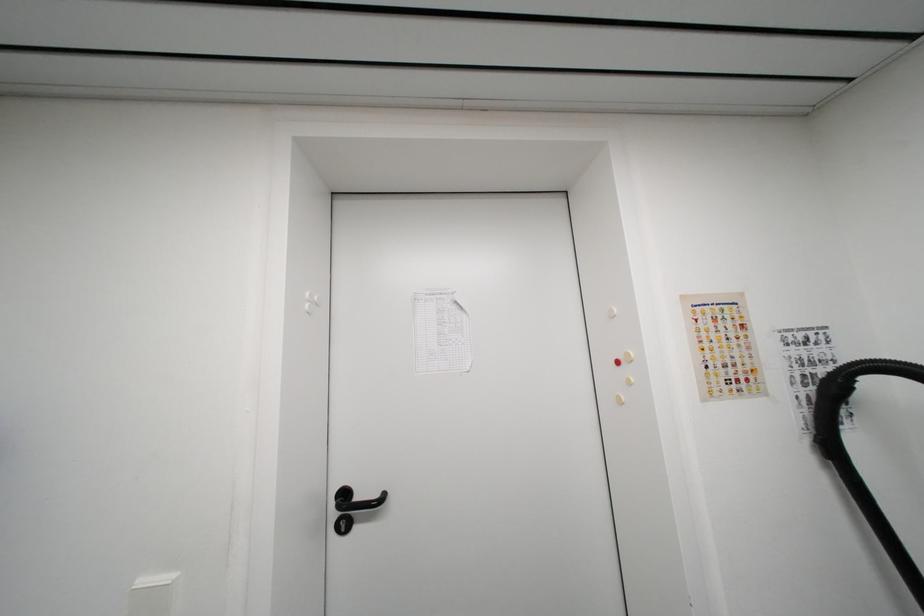
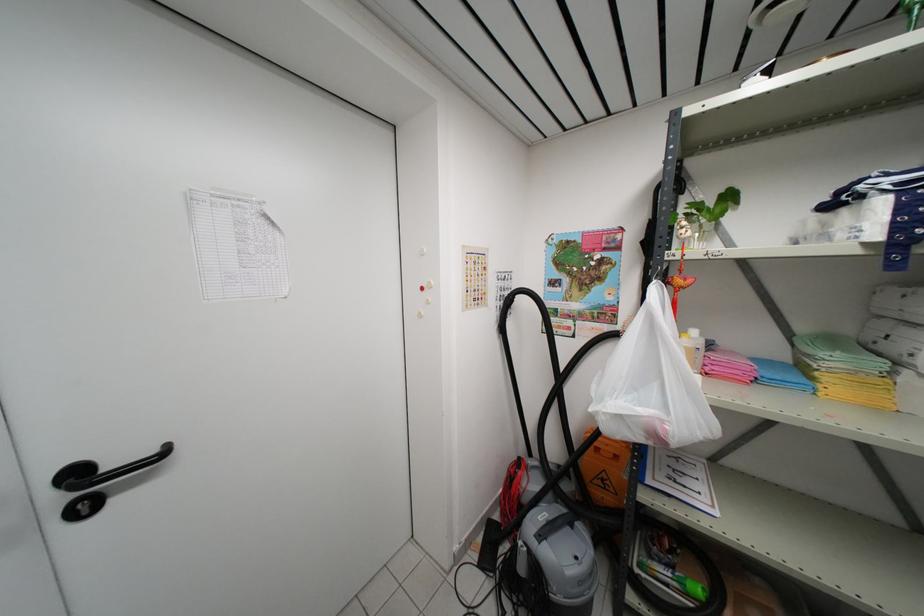
Locate, in the second image, the point that corresponds to point 345,528 in the first image.

(83, 512)